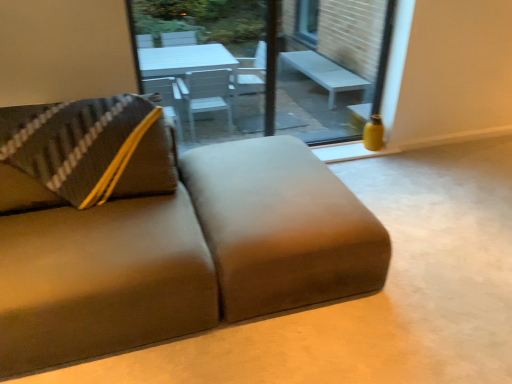
Measure the distance between point [228,193] and camera.

A distance of 6.56 feet exists between point [228,193] and camera.

The height and width of the screenshot is (384, 512). I want to click on matte glass window screen at center, so click(x=338, y=60).

What is the approximate width of matte glass window screen at center?

It is 1.94 inches.

Measure the distance between point (255,101) and camera.

11.10 feet.

Find the location of a particular element. This screenshot has width=512, height=384. suede-like beige footrest at lower center is located at coordinates (281, 227).

Is suede-like beige footrest at lower center to the right of matte glass window screen at center from the viewer's perspective?

No.

Which is correct: suede-like beige footrest at lower center is inside matte glass window screen at center, or outside of it?

suede-like beige footrest at lower center lies outside matte glass window screen at center.

Is suede-like beige footrest at lower center with matte glass window screen at center?

They are not placed beside each other.

How distant is transparent glass window at center from suede-like beige footrest at lower center?

A distance of 1.47 meters exists between transparent glass window at center and suede-like beige footrest at lower center.

Is point (374, 62) positioned before point (288, 284)?

No, (374, 62) is further to viewer.

In the scene shown: Is transparent glass window at center oriented away from suede-like beige footrest at lower center?

No, transparent glass window at center is not facing the opposite direction of suede-like beige footrest at lower center.

Does transparent glass window at center have a greater height compared to suede-like beige footrest at lower center?

Yes.

Is suede-like brown studio couch at lower left facing away from suede-like beige footrest at lower center?

No, suede-like brown studio couch at lower left is not facing the opposite direction of suede-like beige footrest at lower center.

From the picture: Based on their sizes in the image, would you say suede-like brown studio couch at lower left is bigger or smaller than suede-like beige footrest at lower center?

In the image, suede-like brown studio couch at lower left appears to be smaller than suede-like beige footrest at lower center.

From a real-world perspective, which is physically below, suede-like brown studio couch at lower left or suede-like beige footrest at lower center?

suede-like brown studio couch at lower left.

Would you consider suede-like brown studio couch at lower left to be distant from suede-like beige footrest at lower center?

Actually, suede-like brown studio couch at lower left and suede-like beige footrest at lower center are a little close together.

How many degrees apart are the facing directions of yellow matte vase at right and transparent glass window at center?

The angle between the facing direction of yellow matte vase at right and the facing direction of transparent glass window at center is 2.95 degrees.

Considering the sizes of yellow matte vase at right and transparent glass window at center in the image, is yellow matte vase at right taller or shorter than transparent glass window at center?

yellow matte vase at right is shorter than transparent glass window at center.

Consider the image. Is there a large distance between yellow matte vase at right and transparent glass window at center?

Yes, yellow matte vase at right and transparent glass window at center are quite far apart.

From the image's perspective, is yellow matte vase at right located above or below transparent glass window at center?

Clearly, from the image's perspective, yellow matte vase at right is below transparent glass window at center.

Can you tell me how much suede-like beige footrest at lower center and suede-like brown studio couch at lower left differ in facing direction?

The angular difference between suede-like beige footrest at lower center and suede-like brown studio couch at lower left is 88.9 degrees.

Consider the image. Measure the distance between suede-like beige footrest at lower center and suede-like brown studio couch at lower left.

suede-like beige footrest at lower center is 5.49 inches from suede-like brown studio couch at lower left.

At what (x,y) coordinates should I click in order to perform the action: click on studio couch below the suede-like beige footrest at lower center (from a real-world perspective). Please return your answer as a coordinate pair (x, y). Looking at the image, I should click on (162, 232).

Can you confirm if suede-like beige footrest at lower center is thinner than suede-like brown studio couch at lower left?

Yes, suede-like beige footrest at lower center is thinner than suede-like brown studio couch at lower left.

Looking at this image, who is taller, matte glass window screen at center or suede-like brown studio couch at lower left?

With more height is matte glass window screen at center.

Looking at the image, does matte glass window screen at center seem bigger or smaller compared to suede-like brown studio couch at lower left?

In the image, matte glass window screen at center appears to be smaller than suede-like brown studio couch at lower left.

Is matte glass window screen at center next to suede-like brown studio couch at lower left?

No, matte glass window screen at center is not next to suede-like brown studio couch at lower left.

From the image's perspective, is matte glass window screen at center above or below suede-like brown studio couch at lower left?

Based on their image positions, matte glass window screen at center is located above suede-like brown studio couch at lower left.

Locate an element on the screen. The height and width of the screenshot is (384, 512). footrest below the yellow matte vase at right (from the image's perspective) is located at coordinates (281, 227).

Considering the sizes of yellow matte vase at right and suede-like beige footrest at lower center in the image, is yellow matte vase at right bigger or smaller than suede-like beige footrest at lower center?

Clearly, yellow matte vase at right is smaller in size than suede-like beige footrest at lower center.

Considering the positions of points (377, 118) and (223, 247), is point (377, 118) closer to camera compared to point (223, 247)?

No, (377, 118) is behind (223, 247).

Where is `window screen behind the suede-like beige footrest at lower center`? window screen behind the suede-like beige footrest at lower center is located at coordinates (338, 60).

Image resolution: width=512 pixels, height=384 pixels. What are the coordinates of `footrest to the left of transparent glass window at center` in the screenshot? It's located at (281, 227).

Which object lies nearer to the anchor point matte glass window screen at center, yellow matte vase at right or transparent glass window at center?

transparent glass window at center is positioned closer to the anchor matte glass window screen at center.

Which object lies further to the anchor point yellow matte vase at right, suede-like beige footrest at lower center or transparent glass window at center?

Based on the image, suede-like beige footrest at lower center appears to be further to yellow matte vase at right.

Based on the photo, when comparing their distances from matte glass window screen at center, does suede-like brown studio couch at lower left or suede-like beige footrest at lower center seem closer?

suede-like beige footrest at lower center lies closer to matte glass window screen at center than the other object.

Considering their positions, is yellow matte vase at right positioned closer to matte glass window screen at center than suede-like beige footrest at lower center?

yellow matte vase at right is positioned closer to the anchor matte glass window screen at center.

Considering their positions, is matte glass window screen at center positioned further to yellow matte vase at right than transparent glass window at center?

Among the two, matte glass window screen at center is located further to yellow matte vase at right.

When comparing their distances from suede-like brown studio couch at lower left, does matte glass window screen at center or transparent glass window at center seem closer?

The object closer to suede-like brown studio couch at lower left is transparent glass window at center.

Estimate the real-world distances between objects in this image. Which object is closer to suede-like beige footrest at lower center, suede-like brown studio couch at lower left or yellow matte vase at right?

suede-like brown studio couch at lower left lies closer to suede-like beige footrest at lower center than the other object.

Which object lies further to the anchor point suede-like beige footrest at lower center, yellow matte vase at right or transparent glass window at center?

Based on the image, yellow matte vase at right appears to be further to suede-like beige footrest at lower center.

This screenshot has width=512, height=384. Find the location of `window between suede-like beige footrest at lower center and yellow matte vase at right in the front-back direction`. window between suede-like beige footrest at lower center and yellow matte vase at right in the front-back direction is located at coordinates (266, 65).

Where is `footrest between suede-like brown studio couch at lower left and transparent glass window at center in the front-back direction`? This screenshot has height=384, width=512. footrest between suede-like brown studio couch at lower left and transparent glass window at center in the front-back direction is located at coordinates (281, 227).

Locate an element on the screen. The width and height of the screenshot is (512, 384). window located between suede-like brown studio couch at lower left and yellow matte vase at right in the depth direction is located at coordinates (266, 65).

Locate an element on the screen. This screenshot has width=512, height=384. window screen between suede-like brown studio couch at lower left and yellow matte vase at right from front to back is located at coordinates (338, 60).